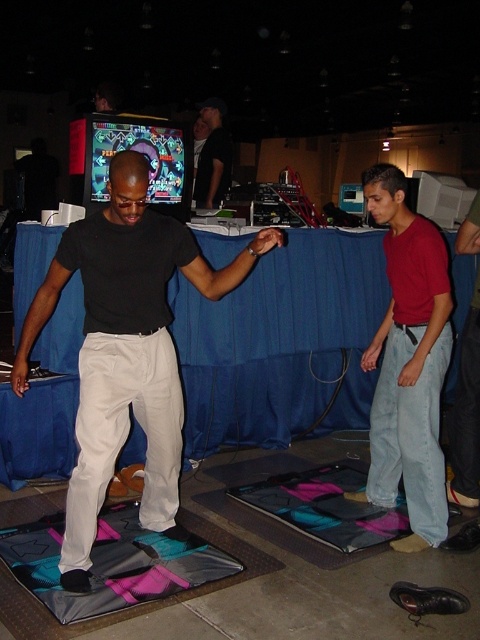
In the scene shown: Between matte black pants at center and teal fabric yoga mat at lower center, which one has less height?

teal fabric yoga mat at lower center is shorter.

Which of these two, matte black pants at center or teal fabric yoga mat at lower center, stands taller?

matte black pants at center

Image resolution: width=480 pixels, height=640 pixels. I want to click on matte black pants at center, so click(x=126, y=349).

Does denim jeans at center have a greater width compared to black t-shirt at center?

Yes, denim jeans at center is wider than black t-shirt at center.

Is point (434, 508) positioned behind point (207, 179)?

No, it is in front of (207, 179).

Does point (435, 364) lie in front of point (215, 148)?

Yes, point (435, 364) is in front of point (215, 148).

Where is `denim jeans at center`? The height and width of the screenshot is (640, 480). denim jeans at center is located at coordinates (408, 364).

Who is shorter, denim jeans at center or teal fabric yoga mat at lower center?

Standing shorter between the two is teal fabric yoga mat at lower center.

Describe the element at coordinates (408, 364) in the screenshot. I see `denim jeans at center` at that location.

Is point (400, 208) positioned before point (29, 604)?

That is False.

The width and height of the screenshot is (480, 640). I want to click on denim jeans at center, so (x=408, y=364).